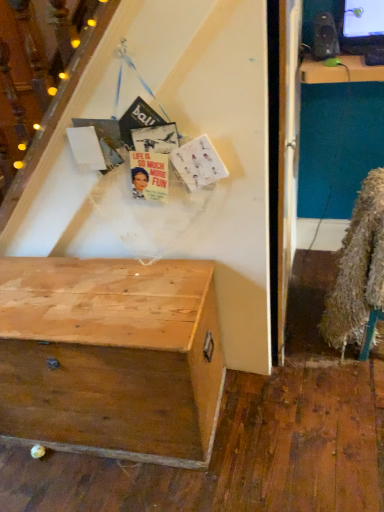
Question: Is wooden chest at lower left not near matte black speaker at upper right?

Choices:
 (A) no
 (B) yes

Answer: (B)

Question: Could you tell me if wooden chest at lower left is turned towards matte black speaker at upper right?

Choices:
 (A) no
 (B) yes

Answer: (A)

Question: Is wooden chest at lower left positioned beyond the bounds of matte black speaker at upper right?

Choices:
 (A) no
 (B) yes

Answer: (B)

Question: Can you confirm if wooden chest at lower left is thinner than matte black speaker at upper right?

Choices:
 (A) no
 (B) yes

Answer: (A)

Question: Considering the relative sizes of wooden chest at lower left and matte black speaker at upper right in the image provided, is wooden chest at lower left wider than matte black speaker at upper right?

Choices:
 (A) yes
 (B) no

Answer: (A)

Question: Does wooden chest at lower left come behind matte black speaker at upper right?

Choices:
 (A) no
 (B) yes

Answer: (A)

Question: Considering the relative positions of fuzzy brown fur coat at lower right and matte black speaker at upper right in the image provided, is fuzzy brown fur coat at lower right to the right of matte black speaker at upper right from the viewer's perspective?

Choices:
 (A) no
 (B) yes

Answer: (B)

Question: Is fuzzy brown fur coat at lower right shorter than matte black speaker at upper right?

Choices:
 (A) no
 (B) yes

Answer: (A)

Question: From a real-world perspective, is fuzzy brown fur coat at lower right over matte black speaker at upper right?

Choices:
 (A) yes
 (B) no

Answer: (B)

Question: Does fuzzy brown fur coat at lower right lie behind matte black speaker at upper right?

Choices:
 (A) no
 (B) yes

Answer: (A)

Question: Does fuzzy brown fur coat at lower right have a larger size compared to matte black speaker at upper right?

Choices:
 (A) no
 (B) yes

Answer: (B)

Question: Is fuzzy brown fur coat at lower right taller than matte black speaker at upper right?

Choices:
 (A) yes
 (B) no

Answer: (A)

Question: Is wooden chest at lower left shorter than fuzzy brown fur coat at lower right?

Choices:
 (A) no
 (B) yes

Answer: (B)